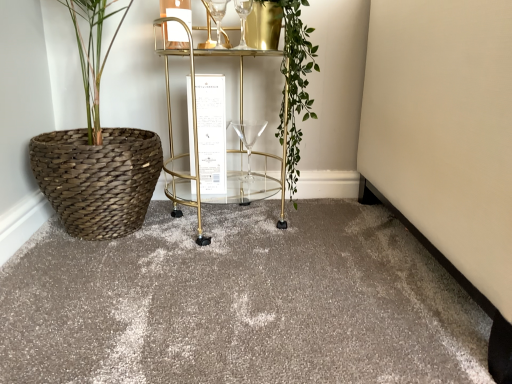
Question: Is clear glass wine glass at upper center, the first wine glass positioned from the top, located within matte gray carpet at center?

Choices:
 (A) yes
 (B) no

Answer: (B)

Question: Is matte gray carpet at center with clear glass wine glass at upper center, the second wine glass in the bottom-to-top sequence?

Choices:
 (A) no
 (B) yes

Answer: (A)

Question: Does matte gray carpet at center have a greater height compared to clear glass wine glass at upper center, marked as the 1th wine glass in a front-to-back arrangement?

Choices:
 (A) no
 (B) yes

Answer: (A)

Question: Can you confirm if matte gray carpet at center is thinner than clear glass wine glass at upper center, the first wine glass positioned from the top?

Choices:
 (A) no
 (B) yes

Answer: (A)

Question: From the image's perspective, does matte gray carpet at center appear higher than clear glass wine glass at upper center, marked as the 1th wine glass in a front-to-back arrangement?

Choices:
 (A) no
 (B) yes

Answer: (A)

Question: From a real-world perspective, is matte gray carpet at center positioned above or below clear glass wine glass at upper center, the second wine glass in the bottom-to-top sequence?

Choices:
 (A) above
 (B) below

Answer: (B)

Question: Based on their positions, is matte gray carpet at center located to the left or right of clear glass wine glass at upper center, the first wine glass positioned from the top?

Choices:
 (A) right
 (B) left

Answer: (A)

Question: Is matte gray carpet at center taller or shorter than clear glass wine glass at upper center, the second wine glass in the bottom-to-top sequence?

Choices:
 (A) short
 (B) tall

Answer: (A)

Question: Would you say matte gray carpet at center is inside or outside clear glass wine glass at upper center, marked as the 1th wine glass in a front-to-back arrangement?

Choices:
 (A) outside
 (B) inside

Answer: (A)

Question: Looking at their shapes, would you say gold metallic bar cart at center is wider or thinner than clear glass wine glass at upper center, the second wine glass in the bottom-to-top sequence?

Choices:
 (A) thin
 (B) wide

Answer: (B)

Question: In the image, is gold metallic bar cart at center positioned in front of or behind clear glass wine glass at upper center, arranged as the second wine glass when viewed from the back?

Choices:
 (A) front
 (B) behind

Answer: (A)

Question: In terms of height, does gold metallic bar cart at center look taller or shorter compared to clear glass wine glass at upper center, the first wine glass positioned from the top?

Choices:
 (A) tall
 (B) short

Answer: (A)

Question: From a real-world perspective, is gold metallic bar cart at center above or below clear glass wine glass at upper center, the second wine glass in the bottom-to-top sequence?

Choices:
 (A) below
 (B) above

Answer: (A)

Question: Relative to matte gray carpet at center, is green leafy plant at center in front or behind?

Choices:
 (A) front
 (B) behind

Answer: (B)

Question: In the image, is green leafy plant at center on the left side or the right side of matte gray carpet at center?

Choices:
 (A) left
 (B) right

Answer: (B)